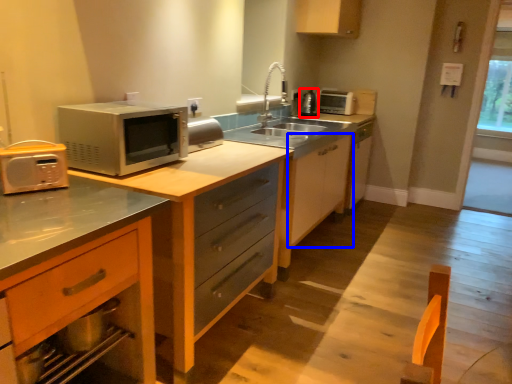
Question: Which of the following is the closest to the observer, appliance (highlighted by a red box) or cabinetry (highlighted by a blue box)?

Choices:
 (A) appliance
 (B) cabinetry

Answer: (B)